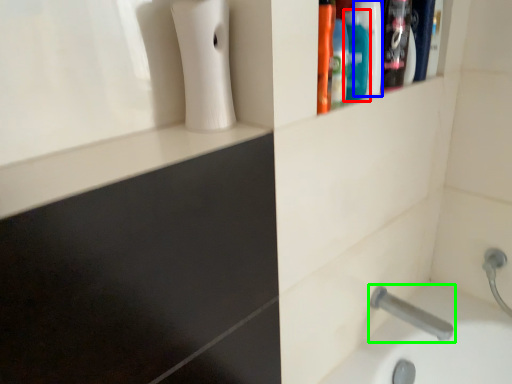
Question: Which is nearer to the mouthwash (highlighted by a red box)? mouthwash (highlighted by a blue box) or tap (highlighted by a green box).

Choices:
 (A) mouthwash
 (B) tap

Answer: (A)